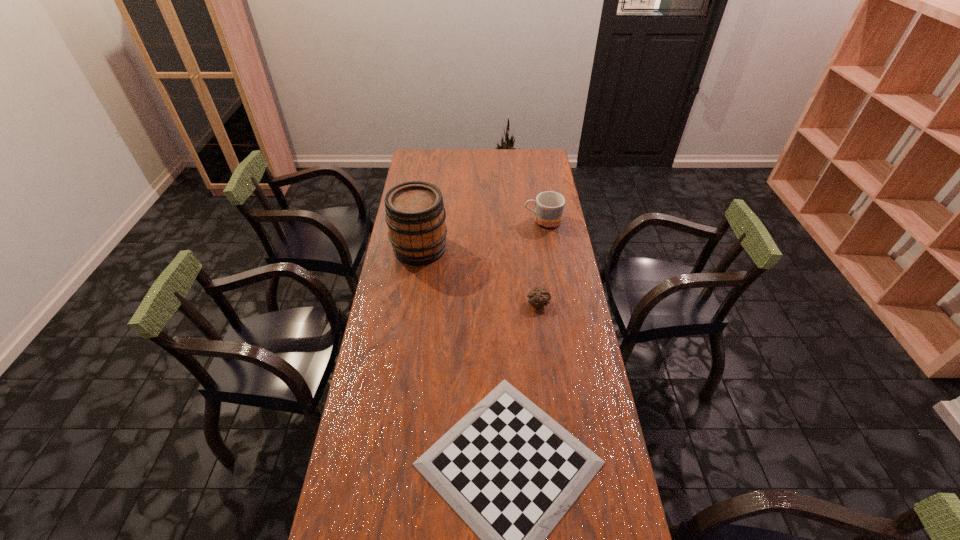
What are the coordinates of `free space located 0.270m on the left of the second shortest object` in the screenshot? It's located at (455, 303).

This screenshot has height=540, width=960. What are the coordinates of `object positioned at the left edge` in the screenshot? It's located at (415, 214).

Image resolution: width=960 pixels, height=540 pixels. Identify the location of mug at the right edge. (549, 205).

I want to click on muffin present at the right edge, so click(x=538, y=297).

The height and width of the screenshot is (540, 960). In order to click on free space at the far edge of the desktop in this screenshot , I will do `click(447, 157)`.

At what (x,y) coordinates should I click in order to perform the action: click on vacant space at the left edge of the desktop. Please return your answer as a coordinate pair (x, y). This screenshot has width=960, height=540. Looking at the image, I should click on [x=374, y=516].

In the image, there is a desktop. Where is `vacant space at the right edge`? vacant space at the right edge is located at coordinates (530, 223).

In the image, there is a desktop. At what (x,y) coordinates should I click in order to perform the action: click on vacant space at the far left corner. Please return your answer as a coordinate pair (x, y). This screenshot has width=960, height=540. Looking at the image, I should click on (413, 150).

Find the location of a particular element. The height and width of the screenshot is (540, 960). vacant space that is in between the third nearest object and the third shortest object is located at coordinates (481, 234).

You are a GUI agent. You are given a task and a screenshot of the screen. Output one action in this format:
    pyautogui.click(x=<x>, y=<y>)
    Task: Click on the empty space that is in between the tallest object and the muffin
    
    Given the screenshot: What is the action you would take?
    coord(479,275)